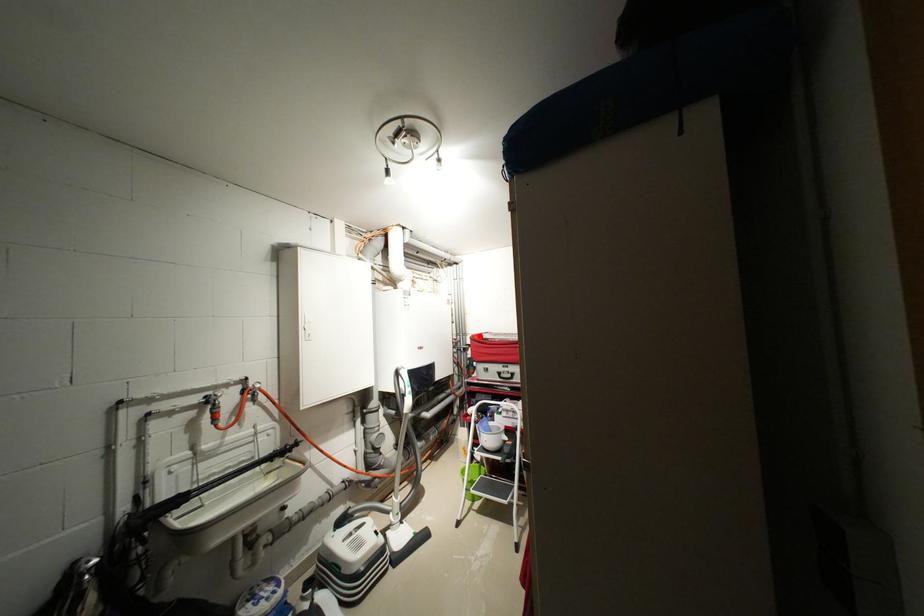
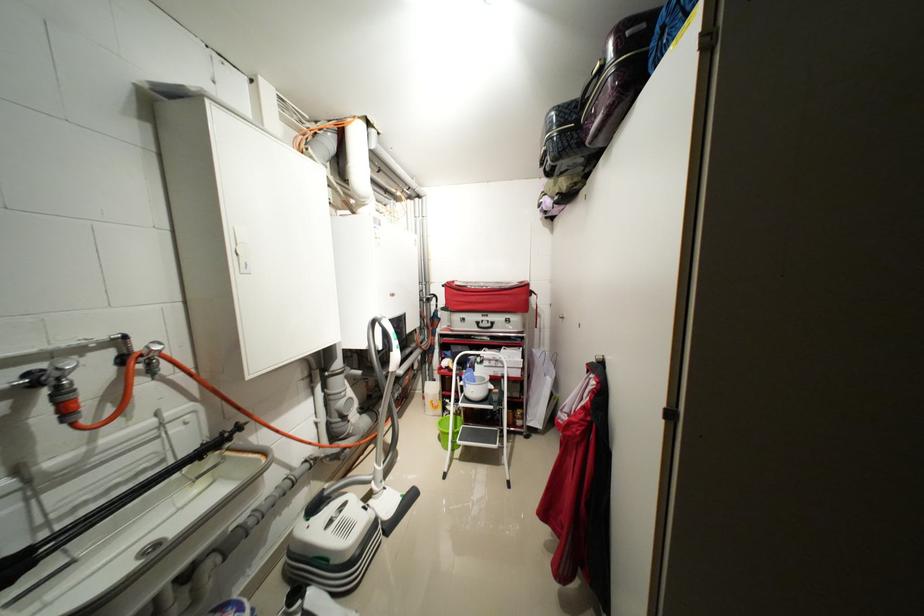
Find the pixel in the second image that matches the highlighted location in the first image.

(455, 284)